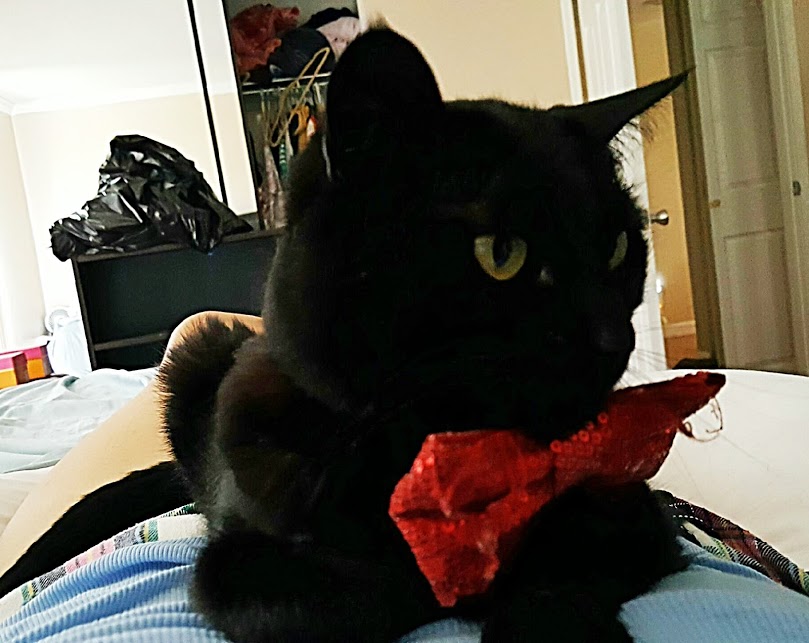
Image resolution: width=809 pixels, height=643 pixels. Find the location of `door handle`. door handle is located at coordinates (663, 213).